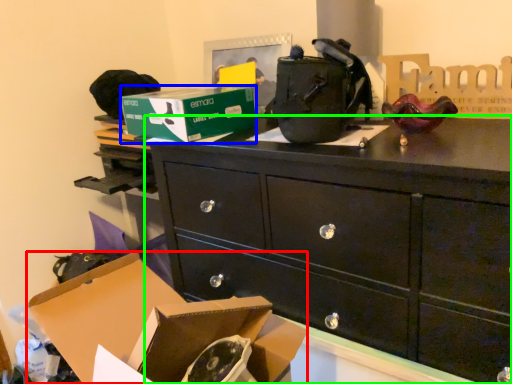
Question: Which object is the farthest from box (highlighted by a red box)? Choose among these: box (highlighted by a blue box) or chest of drawers (highlighted by a green box).

Choices:
 (A) box
 (B) chest of drawers

Answer: (A)